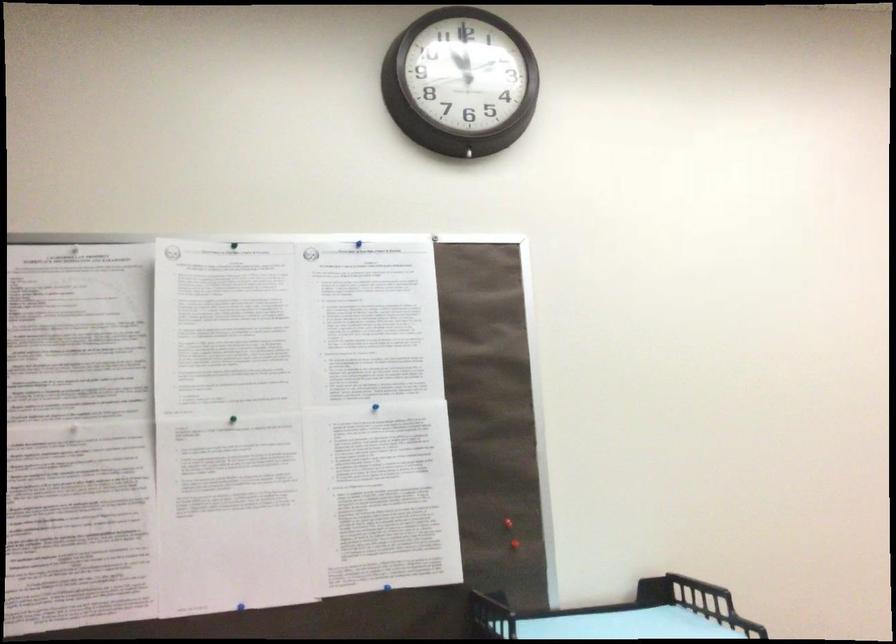
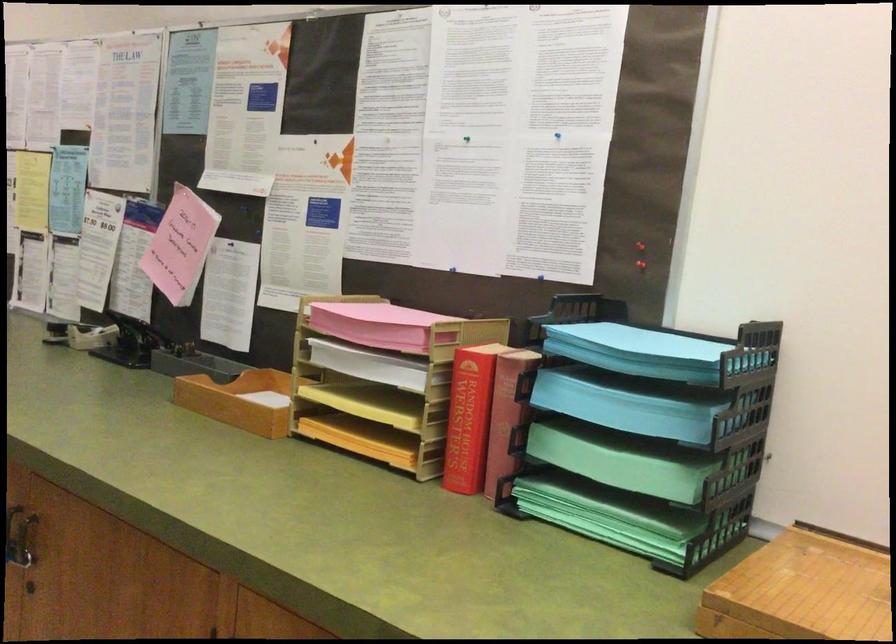
In the second image, find the point that corresponds to pixel 367 409 in the first image.

(556, 135)